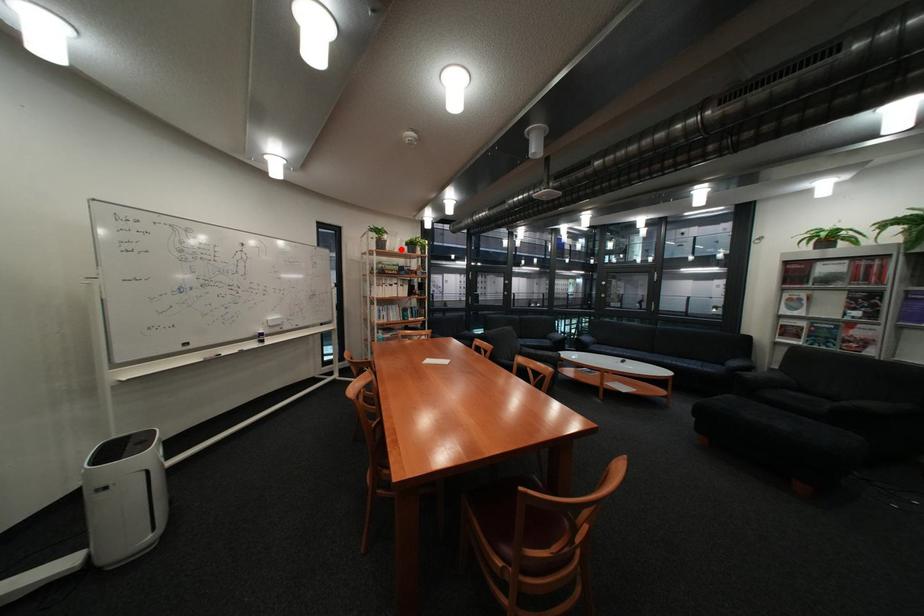
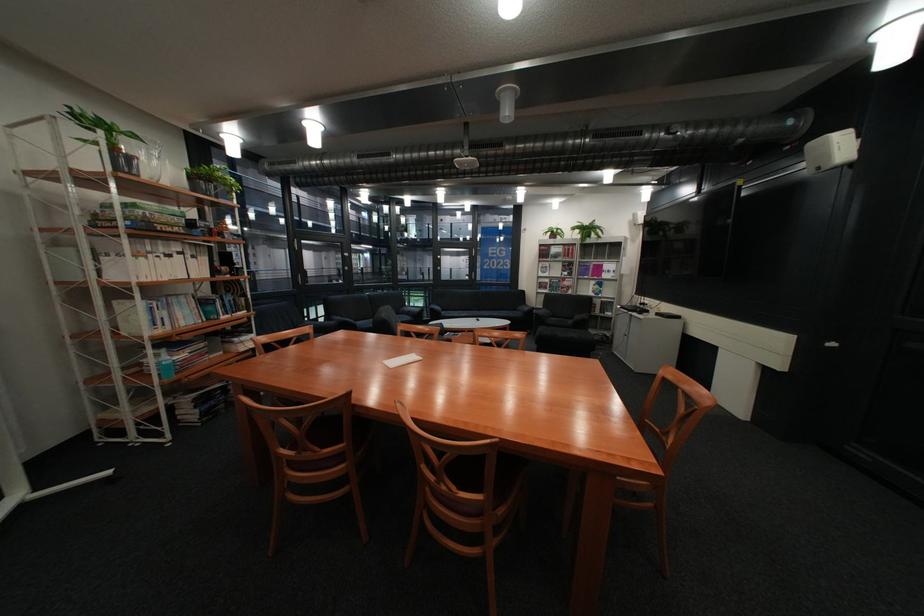
Locate, in the second image, the point that corresponds to the highlighted location in the first image.

(152, 177)